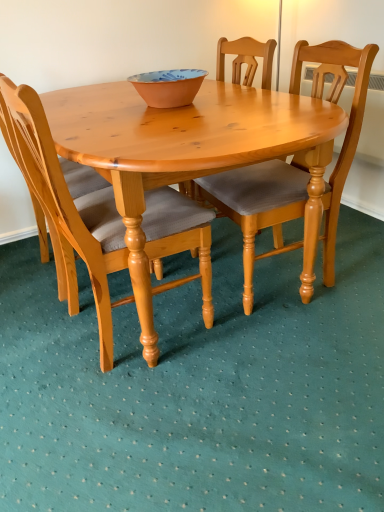
I want to click on free space in front of light wood/texture chair at center, which is the 1th chair in left-to-right order, so click(x=138, y=433).